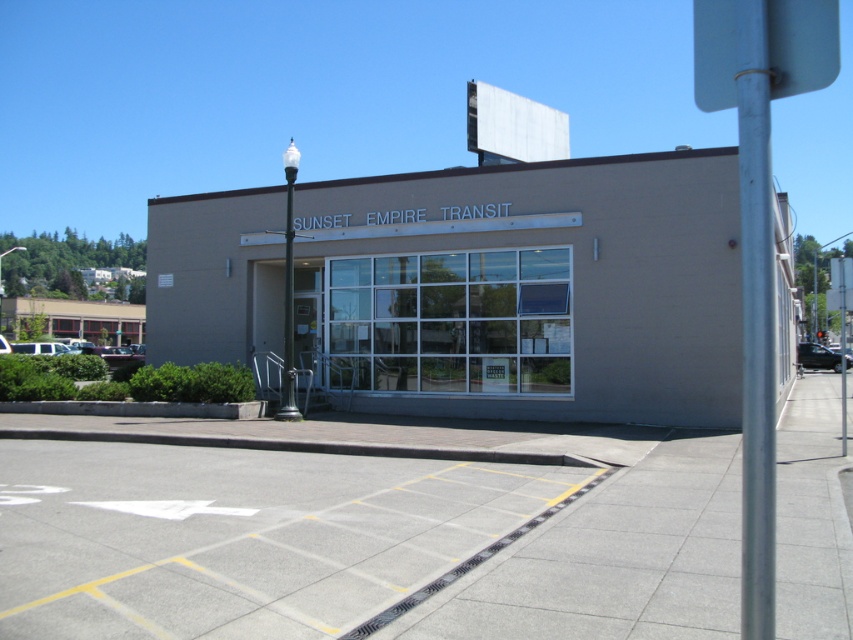
Question: Is beige concrete building at center above metallic silver sign at upper right?

Choices:
 (A) no
 (B) yes

Answer: (A)

Question: Considering the real-world distances, which object is farthest from the metallic silver sign at upper right?

Choices:
 (A) beige concrete building at center
 (B) silver metallic pole at right

Answer: (A)

Question: Which object is positioned farthest from the silver metallic pole at right?

Choices:
 (A) beige concrete building at center
 (B) metallic silver sign at upper right

Answer: (A)

Question: Which point is closer to the camera?

Choices:
 (A) metallic silver sign at upper right
 (B) silver metallic pole at right

Answer: (B)

Question: From the image, what is the correct spatial relationship of beige concrete building at center in relation to metallic silver sign at upper right?

Choices:
 (A) left
 (B) right

Answer: (B)

Question: Is metallic silver sign at upper right to the left of silver metallic pole at right from the viewer's perspective?

Choices:
 (A) yes
 (B) no

Answer: (B)